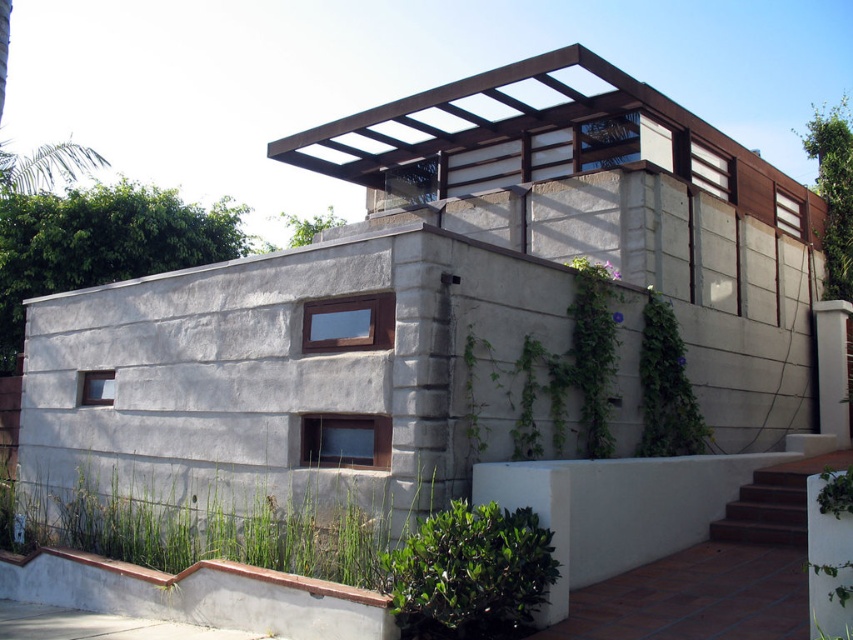
What are the coordinates of the green leafy plant at lower left?

The green leafy plant at lower left is located at coordinates point (199, 595).

You are standing in front of the modern house and notice two green plants. One is the green leafy bush at lower center and the other is the green leafy vine at upper right. Which of these plants is located to the left of the other?

The green leafy bush at lower center is positioned on the left side of the green leafy vine at upper right.

You are standing at the entrance of the modern house and want to place a small decorative pot exactly at the coordinates mentioned in the scene. Where should you place the pot relative to the green leafy bush at lower center?

The green leafy bush at lower center is located at point (x=469, y=573), so you should place the decorative pot at those exact coordinates relative to the bush.